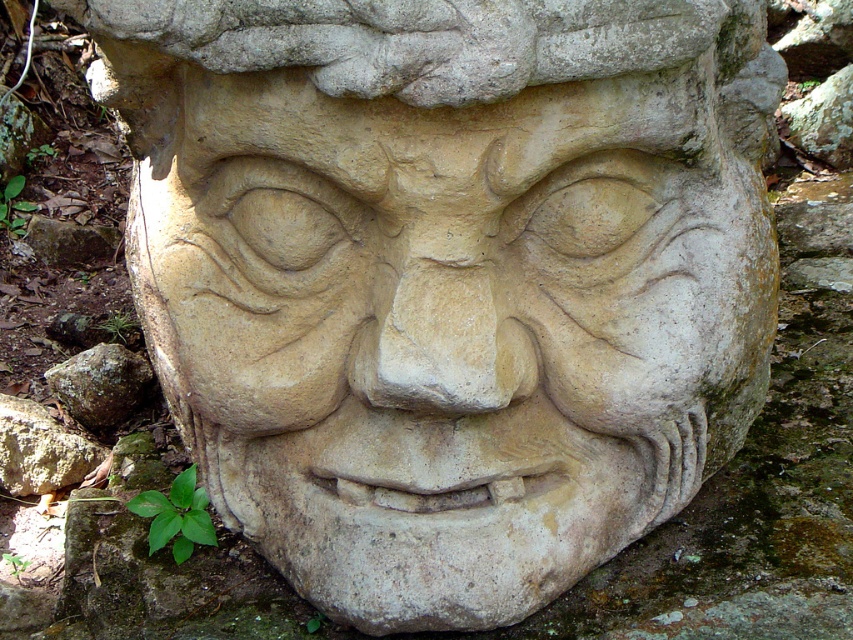
You are an archaeologist examining the sculpture. You notice two materials at the lower left corner of the sculpture. Which material is positioned lower between the gray stone at lower left and the brown rough rock at lower left?

The gray stone at lower left is positioned lower than the brown rough rock at lower left as it is located below it.

You are an archaeologist examining the sculpture up close. You notice two materials near the base of the sculpture. The gray stone at lower left and the brown rough rock at lower left are both present. If you have a tool that measures 2 inches in length, can you fit it between them to take samples?

The gray stone at lower left and brown rough rock at lower left are 1.89 inches apart from each other. Since the tool is 2 inches long, it cannot fit between them as the distance is shorter than the tool.